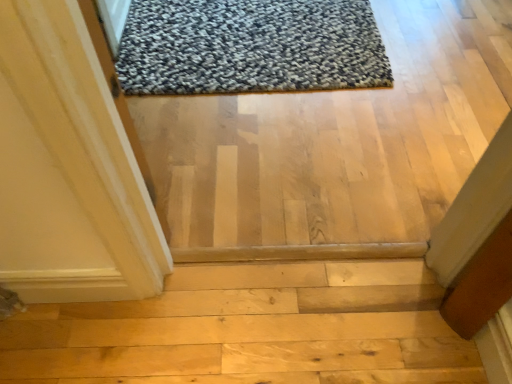
Question: Is natural wood stairs at center taller or shorter than textured gray rug at upper center?

Choices:
 (A) short
 (B) tall

Answer: (B)

Question: Considering the positions of point (311, 286) and point (350, 34), is point (311, 286) closer or farther from the camera than point (350, 34)?

Choices:
 (A) closer
 (B) farther

Answer: (A)

Question: Based on their positions, is natural wood stairs at center located to the left or right of textured gray rug at upper center?

Choices:
 (A) left
 (B) right

Answer: (A)

Question: From a real-world perspective, relative to natural wood stairs at center, is textured gray rug at upper center vertically above or below?

Choices:
 (A) below
 (B) above

Answer: (B)

Question: Which is correct: textured gray rug at upper center is inside natural wood stairs at center, or outside of it?

Choices:
 (A) outside
 (B) inside

Answer: (A)

Question: Is textured gray rug at upper center in front of or behind natural wood stairs at center in the image?

Choices:
 (A) front
 (B) behind

Answer: (B)

Question: Is point (284, 21) closer or farther from the camera than point (351, 377)?

Choices:
 (A) closer
 (B) farther

Answer: (B)